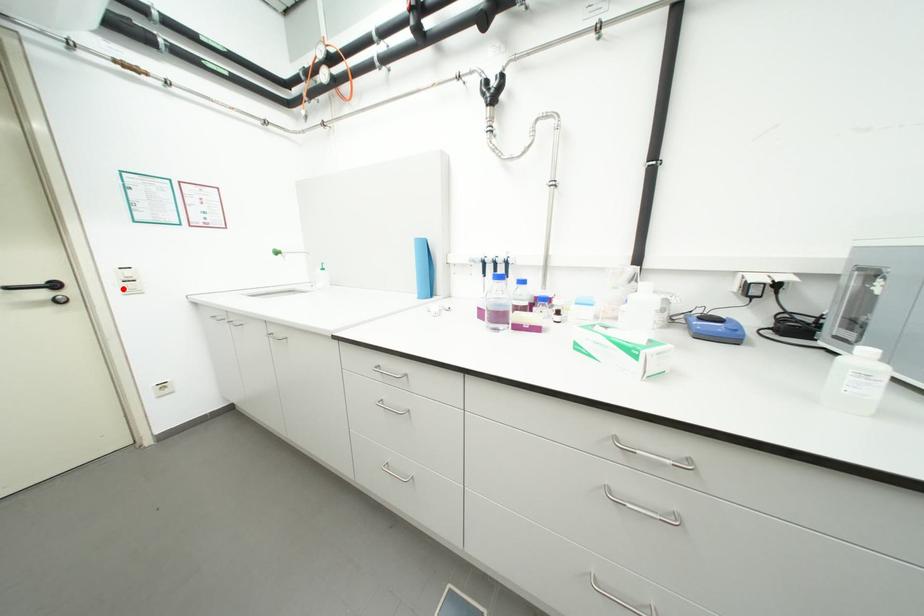
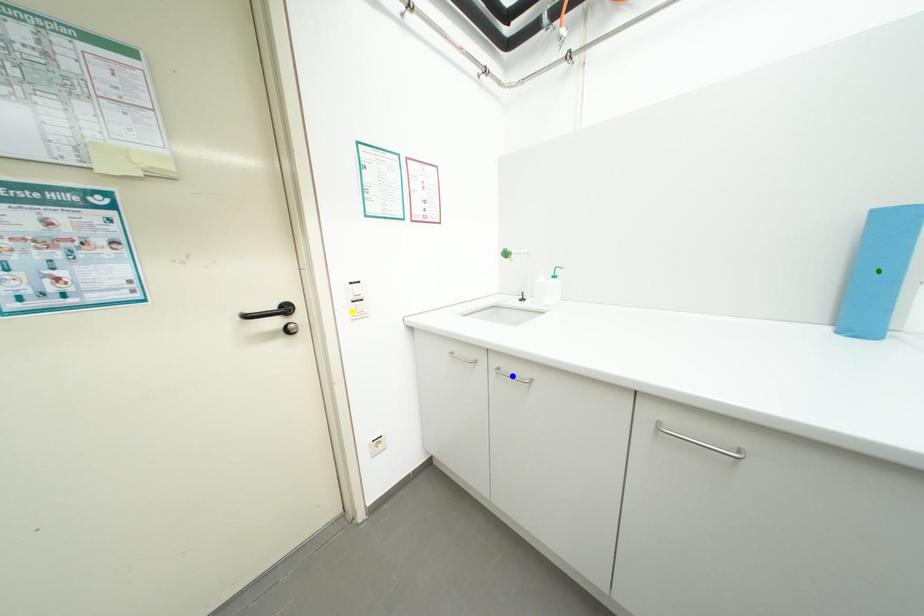
Question: I am providing you with two images of the same scene from different viewpoints. A red point is marked on the first image. You are given multiple points on the second image. Can you choose the point in image 2 that corresponds to the point in image 1?

Choices:
 (A) green point
 (B) yellow point
 (C) blue point

Answer: (B)